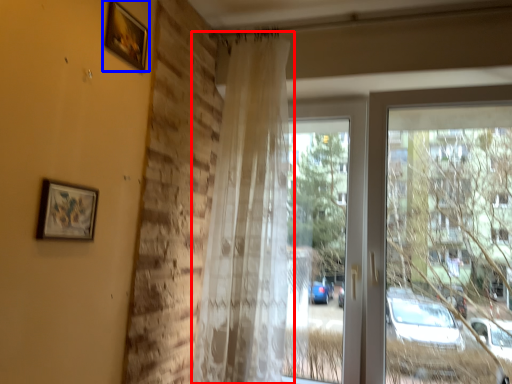
Question: Which object is closer to the camera taking this photo, curtain (highlighted by a red box) or picture frame (highlighted by a blue box)?

Choices:
 (A) curtain
 (B) picture frame

Answer: (B)